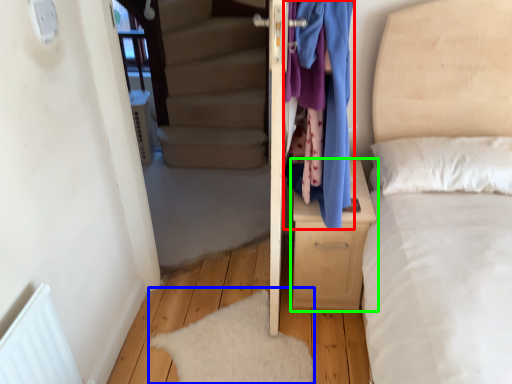
Question: Estimate the real-world distances between objects in this image. Which object is closer to clothing (highlighted by a red box), mat (highlighted by a blue box) or nightstand (highlighted by a green box)?

Choices:
 (A) mat
 (B) nightstand

Answer: (B)